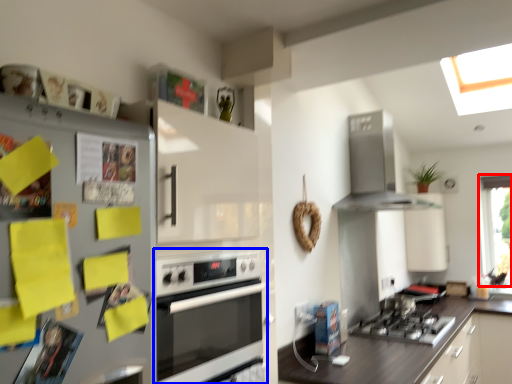
Question: Which object is further to the camera taking this photo, window (highlighted by a red box) or oven (highlighted by a blue box)?

Choices:
 (A) window
 (B) oven

Answer: (A)